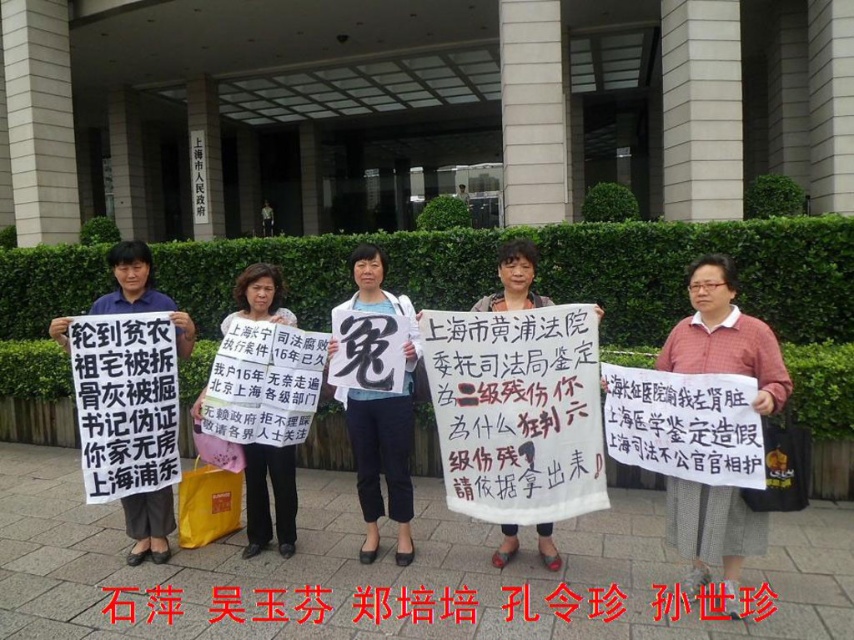
You are a photographer standing in front of the Shanghai Municipal Government building. You notice two pink items at the center of the scene. Which one is closer to you, the pink checkered shirt at center or the pink fabric sign at center?

The pink checkered shirt at center is in front of the pink fabric sign at center, so the pink checkered shirt at center is closer to you.

You are a photographer standing at the center of the scene. You want to take a photo that includes both the point at point (351, 600) and the point at point (145, 508). Which point should you focus on first to ensure both are in the frame?

Since point (351, 600) is in front of point (145, 508), you should focus on point (351, 600) first to ensure both are in the frame.